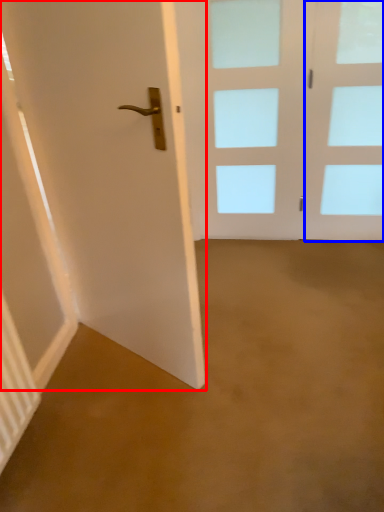
Question: Which object appears farthest to the camera in this image, door (highlighted by a red box) or glass door (highlighted by a blue box)?

Choices:
 (A) door
 (B) glass door

Answer: (B)